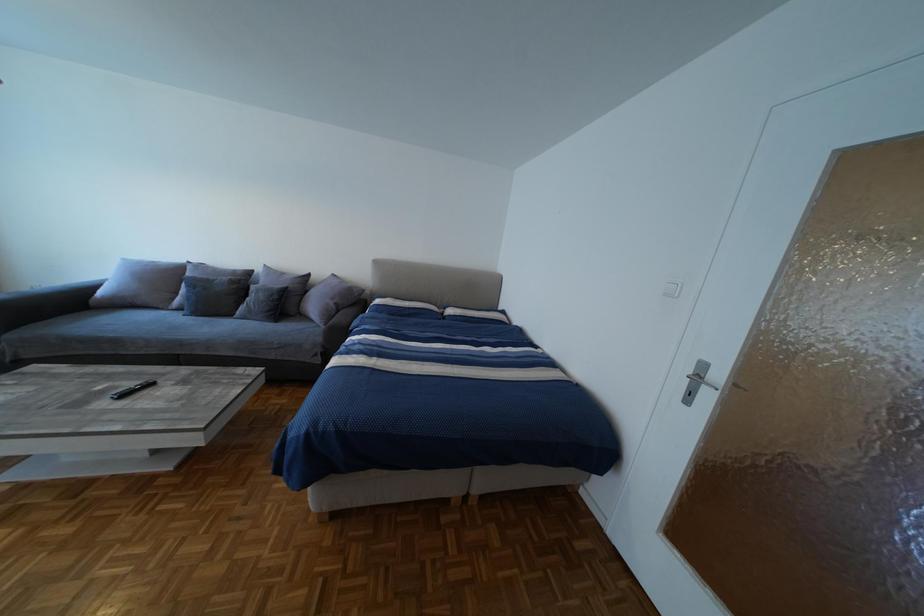
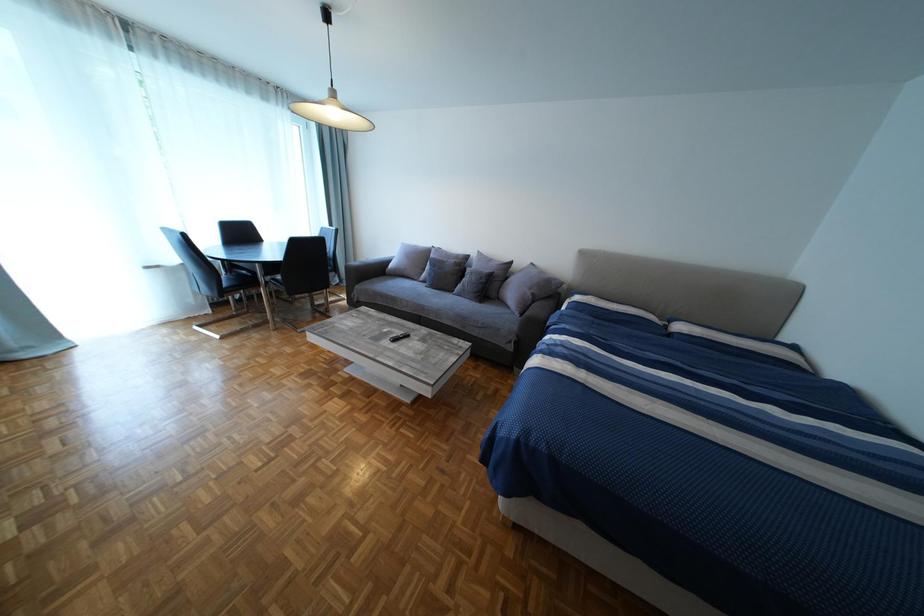
Question: The camera is either moving clockwise (left) or counter-clockwise (right) around the object. The first image is from the beginning of the video and the second image is from the end. Is the camera moving left or right when shooting the video?

Choices:
 (A) Left
 (B) Right

Answer: (B)